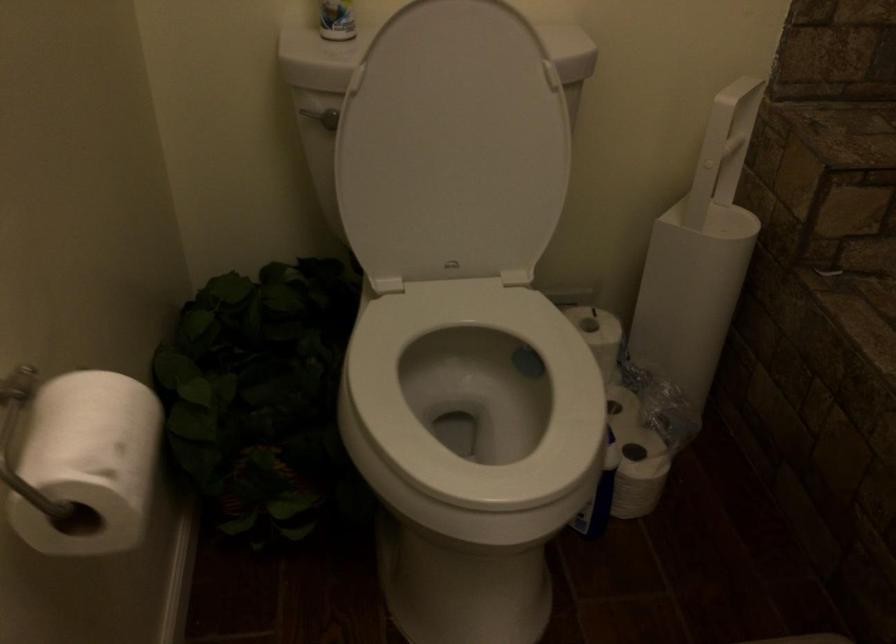
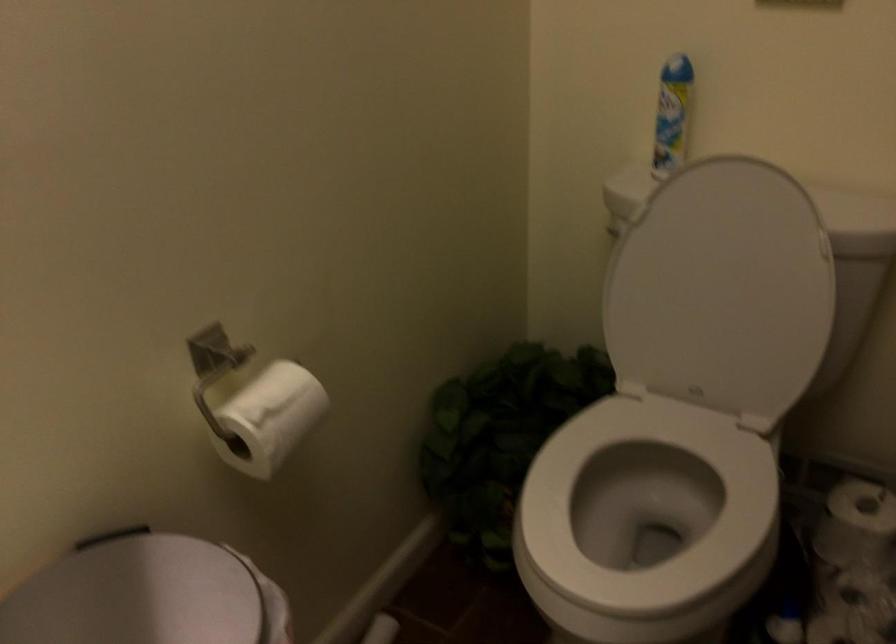
Locate, in the second image, the point that corresponds to pixel 459 147 in the first image.

(721, 289)